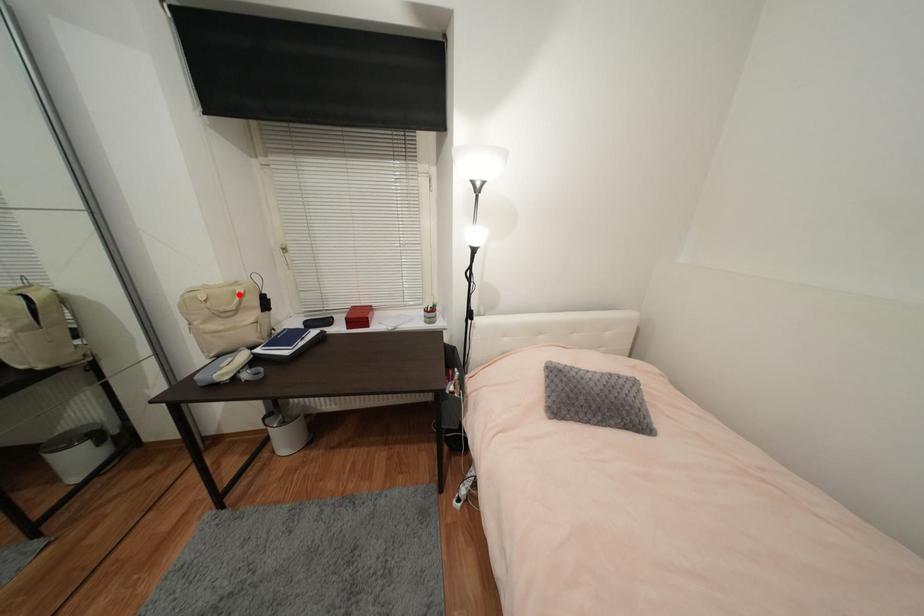
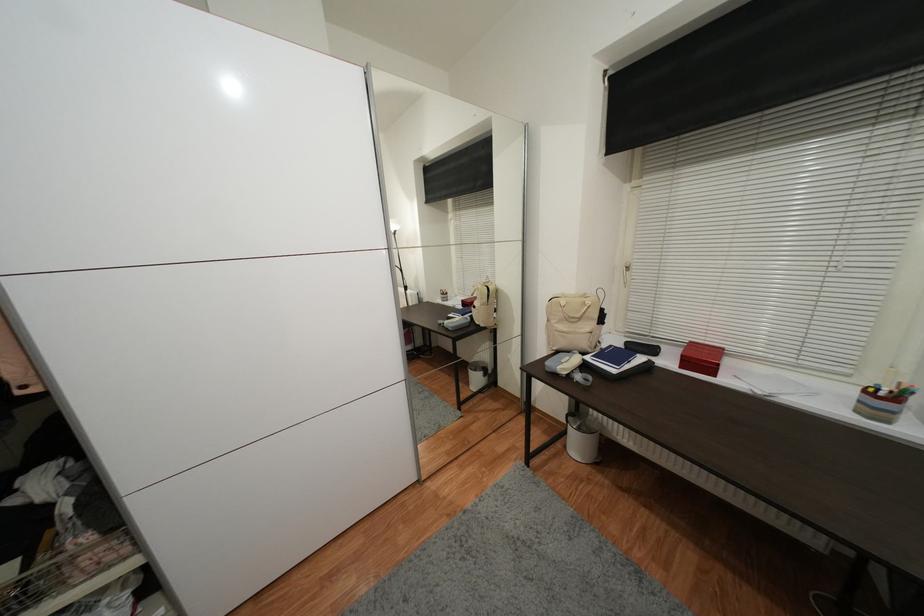
Question: I am providing you with two images of the same scene from different viewpoints. A red point is shown in image1. For the corresponding object point in image2, is it positioned nearer or farther from the camera?

Choices:
 (A) Nearer
 (B) Farther

Answer: (B)